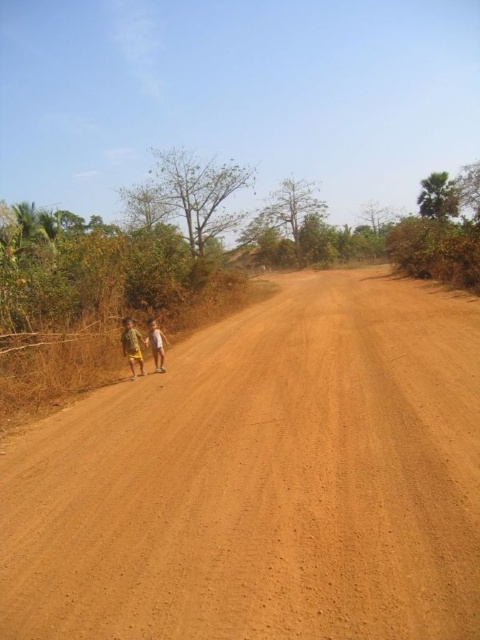
You are a delivery driver approaching the brown sandy dirt track at center. You notice the yellow fabric shorts at left nearby. Can your 2.5 meter wide truck safely pass through the track without hitting the shorts?

The brown sandy dirt track at center is wider than the yellow fabric shorts at left. Since the track is wider than 2.5 meters, the truck can safely pass through without hitting the shorts.